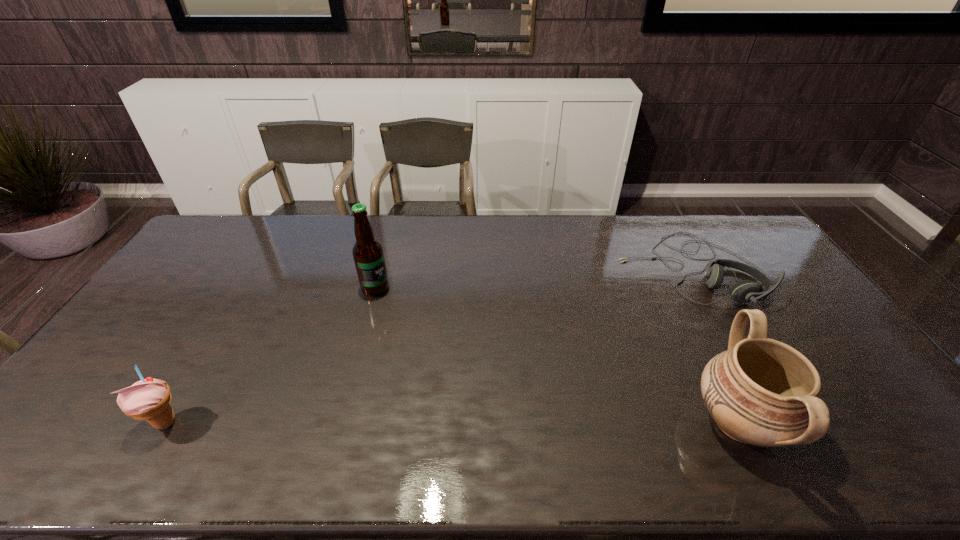
You are a GUI agent. You are given a task and a screenshot of the screen. Output one action in this format:
    pyautogui.click(x=<x>, y=<y>)
    Task: Click on the leftmost object
    The height and width of the screenshot is (540, 960).
    Given the screenshot: What is the action you would take?
    coord(149,399)

At what (x,y) coordinates should I click in order to perform the action: click on the third tallest object. Please return your answer as a coordinate pair (x, y). Image resolution: width=960 pixels, height=540 pixels. Looking at the image, I should click on (149, 399).

Where is `the third shortest object`? The width and height of the screenshot is (960, 540). the third shortest object is located at coordinates (763, 392).

Where is `the shortest object`? Image resolution: width=960 pixels, height=540 pixels. the shortest object is located at coordinates (745, 291).

Where is `beer bottle`? This screenshot has height=540, width=960. beer bottle is located at coordinates (368, 255).

Identify the location of the third object from right to left. (368, 255).

Find the location of `free region located on the back of the third tallest object`. free region located on the back of the third tallest object is located at coordinates (223, 326).

The image size is (960, 540). Identify the location of vacant point located 0.150m on the front-facing side of the third shortest object. (629, 421).

Image resolution: width=960 pixels, height=540 pixels. Find the location of `blank space located on the front-facing side of the third shortest object`. blank space located on the front-facing side of the third shortest object is located at coordinates (666, 421).

Image resolution: width=960 pixels, height=540 pixels. Identify the location of free space located 0.240m on the front-facing side of the third shortest object. (592, 421).